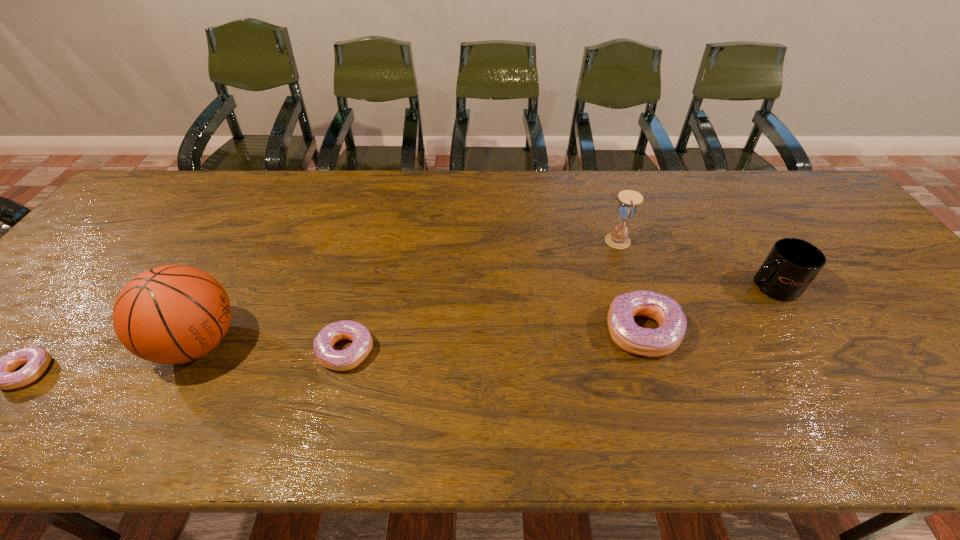
The image size is (960, 540). What are the coordinates of `free space at the left edge of the desktop` in the screenshot? It's located at (115, 230).

I want to click on vacant space at the right edge, so click(x=836, y=215).

You are a GUI agent. You are given a task and a screenshot of the screen. Output one action in this format:
    pyautogui.click(x=<x>, y=<y>)
    Task: Click on the vacant space at the far right corner
    The width and height of the screenshot is (960, 540).
    Given the screenshot: What is the action you would take?
    pyautogui.click(x=807, y=176)

Where is `vacant point located between the fourth object from right to left and the fifth nearest object`? The width and height of the screenshot is (960, 540). vacant point located between the fourth object from right to left and the fifth nearest object is located at coordinates (558, 319).

You are a GUI agent. You are given a task and a screenshot of the screen. Output one action in this format:
    pyautogui.click(x=<x>, y=<y>)
    Task: Click on the vacant space that's between the third shortest object and the second shortest object
    Image resolution: width=960 pixels, height=540 pixels.
    Given the screenshot: What is the action you would take?
    (x=494, y=341)

This screenshot has height=540, width=960. Find the location of `free space between the third tallest object and the third object from left to right`. free space between the third tallest object and the third object from left to right is located at coordinates pyautogui.click(x=558, y=319).

You are a GUI agent. You are given a task and a screenshot of the screen. Output one action in this format:
    pyautogui.click(x=<x>, y=<y>)
    Task: Click on the vacant region between the tallest doughnut and the second tallest object
    
    Given the screenshot: What is the action you would take?
    pyautogui.click(x=629, y=286)

Where is `vacant area that lies between the fifth object from right to left and the mug`? vacant area that lies between the fifth object from right to left and the mug is located at coordinates (484, 315).

The width and height of the screenshot is (960, 540). Find the location of `free space between the tallest doughnut and the tallest object`. free space between the tallest doughnut and the tallest object is located at coordinates (420, 338).

Locate an element on the screen. empty location between the tallest object and the fourth tallest object is located at coordinates (420, 338).